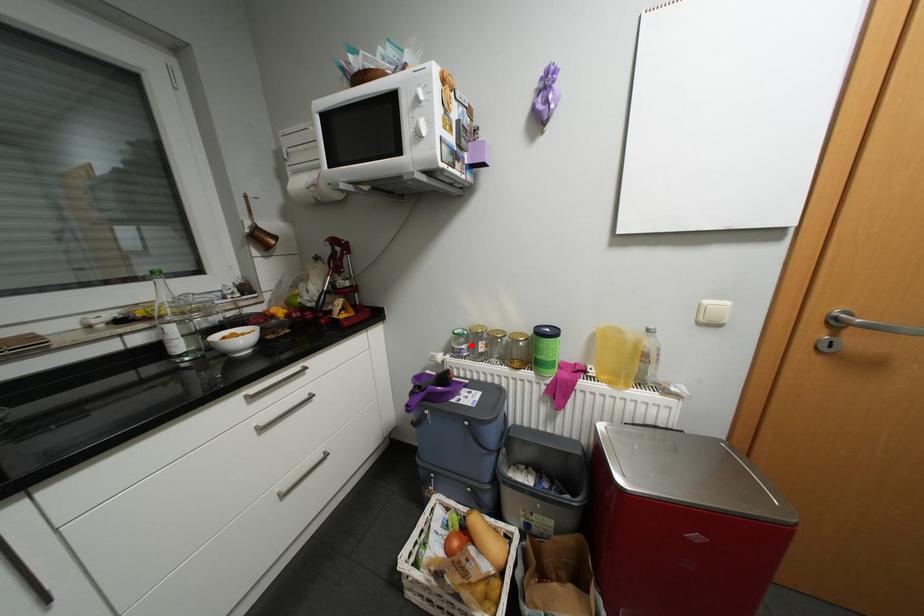
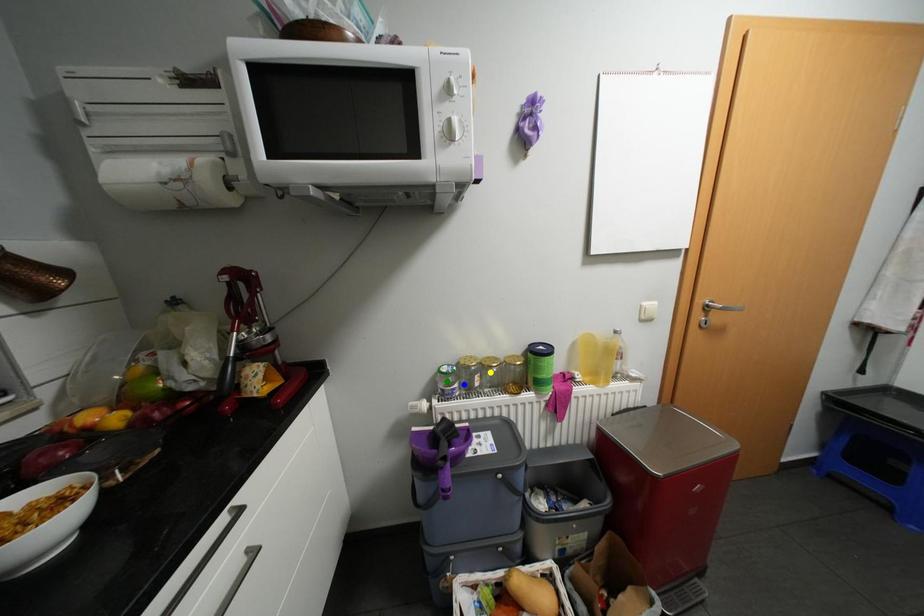
Question: I am providing you with two images of the same scene from different viewpoints. A red point is marked on the first image. You are given multiple points on the second image. Which spot in image 2 lines up with the point in image 1?

Choices:
 (A) green point
 (B) yellow point
 (C) blue point

Answer: (C)